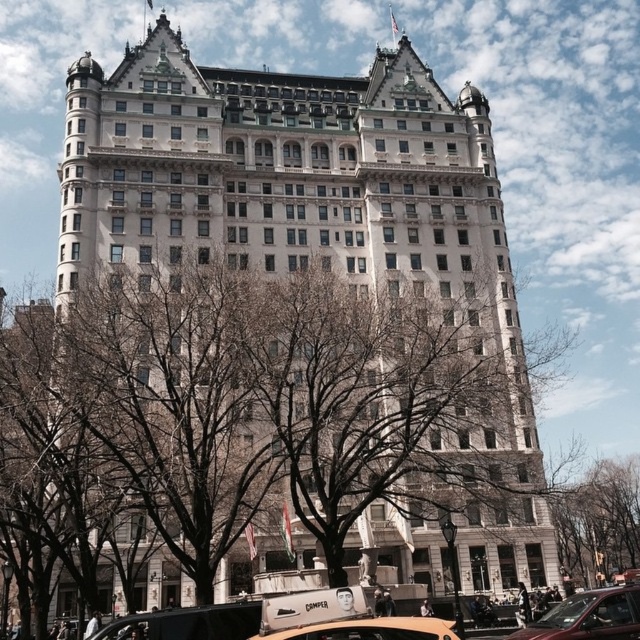
Looking at this image, you are a tourist standing in front of the grand building and want to take a photo of the flagpole with the American flag. You have two vehicles nearby, a metallic red car at lower right and a metallic gold taxi at lower center. Which vehicle is closer to you so you can quickly move to the front for the best shot?

The metallic red car at lower right is closer to you since it has a smaller size compared to the metallic gold taxi at lower center, indicating it is nearer.

You are standing in front of the grand building and want to take a photo of the bare branches at center without including the building in the background. Is the distance sufficient to achieve this?

The bare branches at center are 199.45 feet away from the camera. Since the building is part of the same scene and the branches are relatively far away, it may be challenging to exclude the building from the background in the photo.